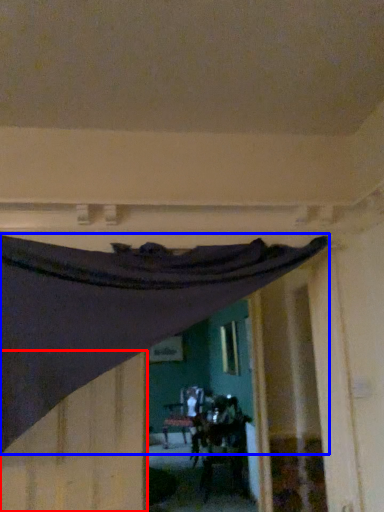
Question: Which of the following is the farthest to the observer, plywood (highlighted by a red box) or curtain (highlighted by a blue box)?

Choices:
 (A) plywood
 (B) curtain

Answer: (A)